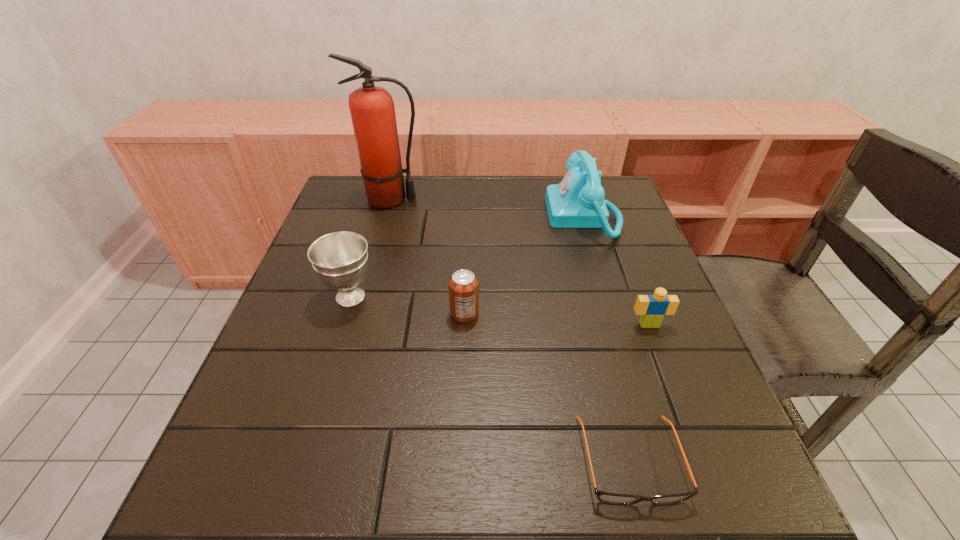
Identify the location of free location located on the dial of the telephone. Image resolution: width=960 pixels, height=540 pixels. (478, 216).

I want to click on free region located 0.090m on the front of the chalice, so click(x=334, y=350).

Identify the location of free space located 0.210m on the right of the fourth object from right to left. (579, 313).

You are a GUI agent. You are given a task and a screenshot of the screen. Output one action in this format:
    pyautogui.click(x=<x>, y=<y>)
    Task: Click on the vacant position located on the face of the Lego
    
    Given the screenshot: What is the action you would take?
    pyautogui.click(x=661, y=356)

Locate an element on the screen. The width and height of the screenshot is (960, 540). fire extinguisher that is at the far edge is located at coordinates (372, 110).

What are the coordinates of `telephone that is at the far edge` in the screenshot? It's located at (577, 201).

Where is `object that is at the near edge`? object that is at the near edge is located at coordinates (612, 498).

The height and width of the screenshot is (540, 960). What are the coordinates of `fire extinguisher present at the left edge` in the screenshot? It's located at (372, 110).

The width and height of the screenshot is (960, 540). Identify the location of chalice present at the left edge. (340, 259).

Locate an element on the screen. telephone that is at the right edge is located at coordinates (577, 201).